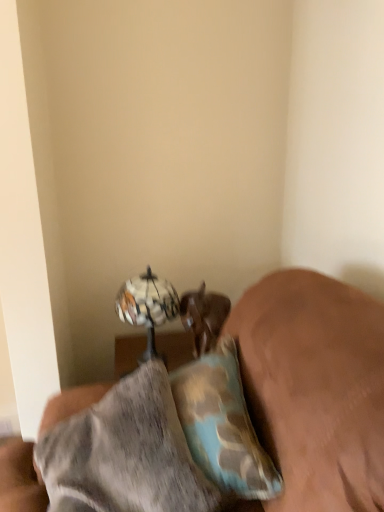
Question: Visually, is brown leather dog at lower center positioned to the left or to the right of metallic reflective globe at upper center?

Choices:
 (A) left
 (B) right

Answer: (B)

Question: Is brown leather dog at lower center taller or shorter than metallic reflective globe at upper center?

Choices:
 (A) short
 (B) tall

Answer: (A)

Question: Which is farther from the camouflage-patterned pillow at center?

Choices:
 (A) metallic reflective globe at upper center
 (B) camouflage fabric pillow at lower right
 (C) brown leather dog at lower center

Answer: (A)

Question: Which of these objects is positioned farthest from the brown leather dog at lower center?

Choices:
 (A) metallic reflective globe at upper center
 (B) camouflage-patterned pillow at center
 (C) camouflage fabric pillow at lower right

Answer: (B)